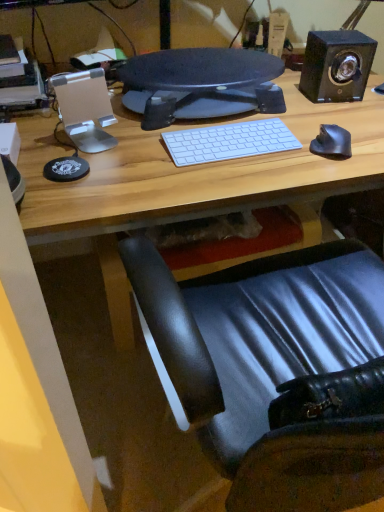
Where is `free space in front of white matte keyboard at center`? free space in front of white matte keyboard at center is located at coordinates (221, 177).